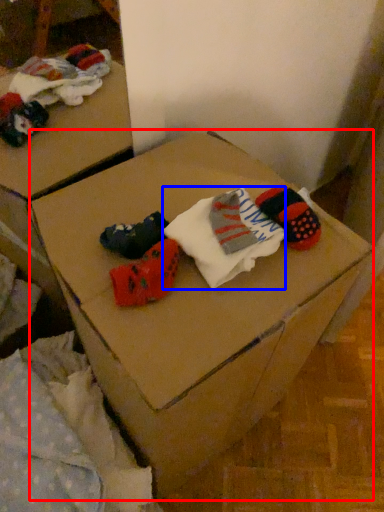
Question: Among these objects, which one is nearest to the camera, furniture (highlighted by a red box) or sock (highlighted by a blue box)?

Choices:
 (A) furniture
 (B) sock

Answer: (A)